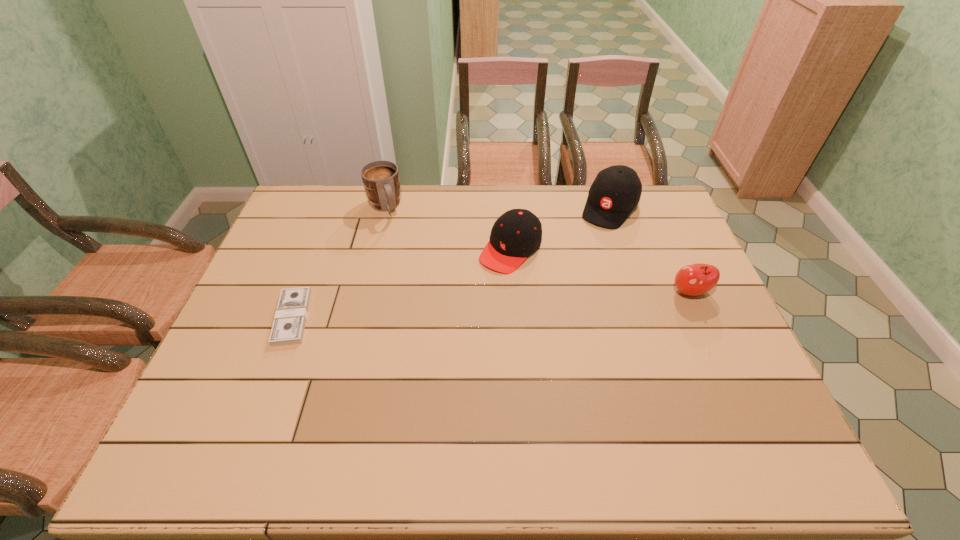
Find the location of a particular element. vacant space located on the front-facing side of the third object from right to left is located at coordinates (408, 363).

Where is `free location located on the side of the second object from left to right with the handle`? The image size is (960, 540). free location located on the side of the second object from left to right with the handle is located at coordinates (409, 261).

Where is `vacant space located on the side of the second object from left to right with the handle`? The height and width of the screenshot is (540, 960). vacant space located on the side of the second object from left to right with the handle is located at coordinates (397, 238).

Identify the location of vacant area located on the side of the second object from left to right with the handle. (417, 275).

Locate an element on the screen. free space located 0.330m with a logo on the front of the baseball cap is located at coordinates (561, 288).

Locate an element on the screen. vacant space situated with a logo on the front of the baseball cap is located at coordinates (562, 286).

Where is `free spot located with a logo on the front of the baseball cap`? The image size is (960, 540). free spot located with a logo on the front of the baseball cap is located at coordinates (558, 293).

You are a GUI agent. You are given a task and a screenshot of the screen. Output one action in this format:
    pyautogui.click(x=<x>, y=<y>)
    Task: Click on the cap present at the far edge
    Image resolution: width=960 pixels, height=540 pixels.
    Given the screenshot: What is the action you would take?
    pyautogui.click(x=516, y=234)

At what (x,y) coordinates should I click in order to perform the action: click on mug present at the far edge. Please return your answer as a coordinate pair (x, y). The image size is (960, 540). Looking at the image, I should click on (380, 178).

This screenshot has height=540, width=960. What are the coordinates of `baseball cap that is at the far edge` in the screenshot? It's located at (616, 191).